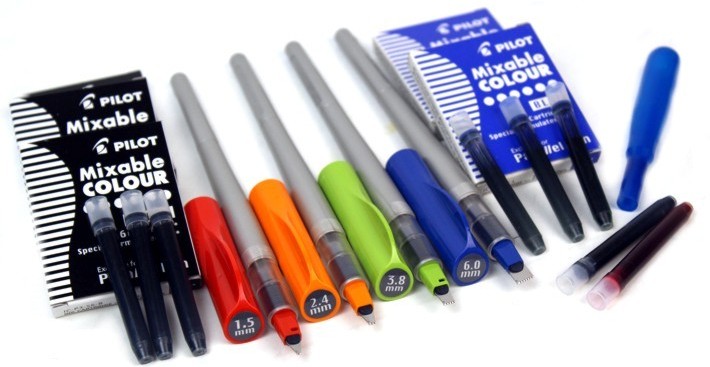
The image size is (710, 367). I want to click on pens, so click(239, 222), click(299, 187), click(356, 162), click(427, 140).